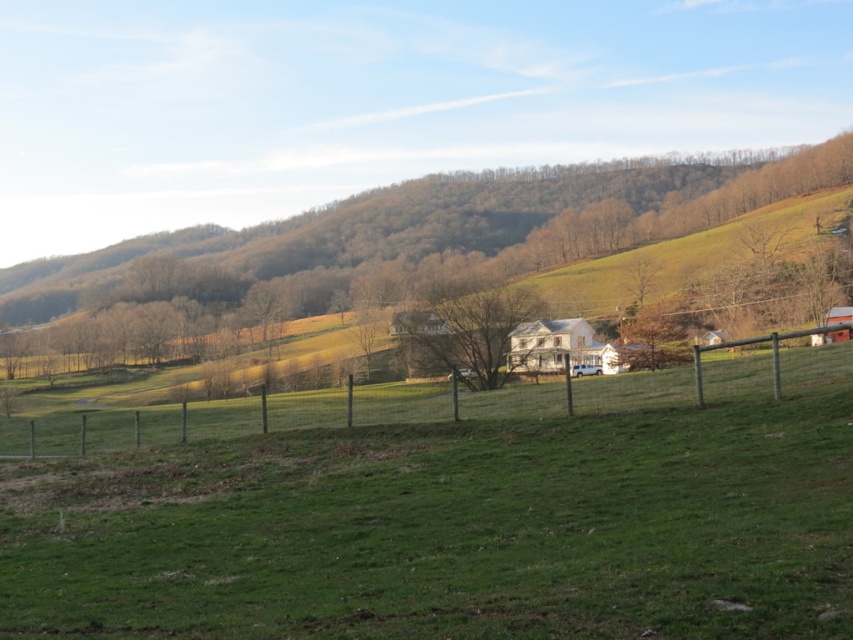
Question: Which point is farther from the camera taking this photo?

Choices:
 (A) (177, 266)
 (B) (437, 323)
 (C) (267, 438)

Answer: (A)

Question: Estimate the real-world distances between objects in this image. Which object is farther from the wooden fence at lower center?

Choices:
 (A) bare branches at center
 (B) green grassy field at center
 (C) green leafy tree at center

Answer: (C)

Question: Observing the image, what is the correct spatial positioning of green grassy field at center in reference to bare branches at center?

Choices:
 (A) above
 (B) below

Answer: (B)

Question: Estimate the real-world distances between objects in this image. Which object is closer to the green grassy field at center?

Choices:
 (A) bare branches at center
 (B) green leafy tree at center

Answer: (A)

Question: Is green grassy field at center behind bare branches at center?

Choices:
 (A) no
 (B) yes

Answer: (A)

Question: Does green grassy field at center appear over bare branches at center?

Choices:
 (A) yes
 (B) no

Answer: (B)